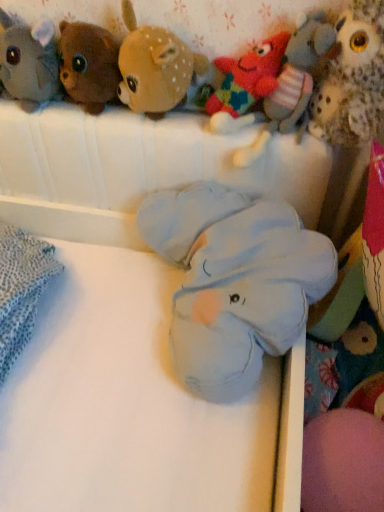
Question: Is fluffy brown owl at upper right, which appears as the seventh toy when viewed from the left, with soft blue plush elephant at center, the fourth toy viewed from the left?

Choices:
 (A) no
 (B) yes

Answer: (A)

Question: Can you confirm if fluffy brown owl at upper right, which appears as the seventh toy when viewed from the left, is positioned to the left of soft blue plush elephant at center, which appears as the fourth toy when viewed from the right?

Choices:
 (A) no
 (B) yes

Answer: (A)

Question: Is fluffy brown owl at upper right, acting as the 1th toy starting from the right, facing towards soft blue plush elephant at center, the fourth toy viewed from the left?

Choices:
 (A) yes
 (B) no

Answer: (B)

Question: Considering the relative sizes of fluffy brown owl at upper right, which appears as the seventh toy when viewed from the left, and soft blue plush elephant at center, which appears as the fourth toy when viewed from the right, in the image provided, is fluffy brown owl at upper right, which appears as the seventh toy when viewed from the left, shorter than soft blue plush elephant at center, which appears as the fourth toy when viewed from the right,?

Choices:
 (A) yes
 (B) no

Answer: (B)

Question: Can you confirm if fluffy brown owl at upper right, which appears as the seventh toy when viewed from the left, is smaller than soft blue plush elephant at center, the fourth toy viewed from the left?

Choices:
 (A) yes
 (B) no

Answer: (A)

Question: Is soft plush deer at upper center, the 3th toy from the left, in front of or behind soft blue plush elephant at center, which appears as the fourth toy when viewed from the right, in the image?

Choices:
 (A) behind
 (B) front

Answer: (A)

Question: From the image's perspective, is soft plush deer at upper center, the 3th toy from the left, positioned above or below soft blue plush elephant at center, which appears as the fourth toy when viewed from the right?

Choices:
 (A) above
 (B) below

Answer: (A)

Question: Is soft plush deer at upper center, the 3th toy from the left, situated inside soft blue plush elephant at center, which appears as the fourth toy when viewed from the right, or outside?

Choices:
 (A) outside
 (B) inside

Answer: (A)

Question: Considering the relative positions of soft plush deer at upper center, which is the 5th toy from right to left, and soft blue plush elephant at center, which appears as the fourth toy when viewed from the right, in the image provided, is soft plush deer at upper center, which is the 5th toy from right to left, to the left or to the right of soft blue plush elephant at center, which appears as the fourth toy when viewed from the right,?

Choices:
 (A) right
 (B) left

Answer: (B)

Question: Is soft plush bear at upper left, which is the 1th toy in left-to-right order, inside or outside of soft blue plush elephant at center, the fourth toy viewed from the left?

Choices:
 (A) outside
 (B) inside

Answer: (A)

Question: Considering the positions of soft plush bear at upper left, which is the 1th toy in left-to-right order, and soft blue plush elephant at center, the fourth toy viewed from the left, in the image, is soft plush bear at upper left, which is the 1th toy in left-to-right order, taller or shorter than soft blue plush elephant at center, the fourth toy viewed from the left,?

Choices:
 (A) tall
 (B) short

Answer: (B)

Question: From the image's perspective, relative to soft blue plush elephant at center, the fourth toy viewed from the left, is soft plush bear at upper left, which is the 1th toy in left-to-right order, above or below?

Choices:
 (A) above
 (B) below

Answer: (A)

Question: Considering the positions of point [x=46, y=69] and point [x=286, y=229], is point [x=46, y=69] closer or farther from the camera than point [x=286, y=229]?

Choices:
 (A) farther
 (B) closer

Answer: (A)

Question: Considering the positions of soft blue plush elephant at center, the fourth toy viewed from the left, and soft blue plush elephant at center in the image, is soft blue plush elephant at center, the fourth toy viewed from the left, wider or thinner than soft blue plush elephant at center?

Choices:
 (A) wide
 (B) thin

Answer: (B)

Question: Is soft blue plush elephant at center, the fourth toy viewed from the left, to the left or to the right of soft blue plush elephant at center in the image?

Choices:
 (A) right
 (B) left

Answer: (A)